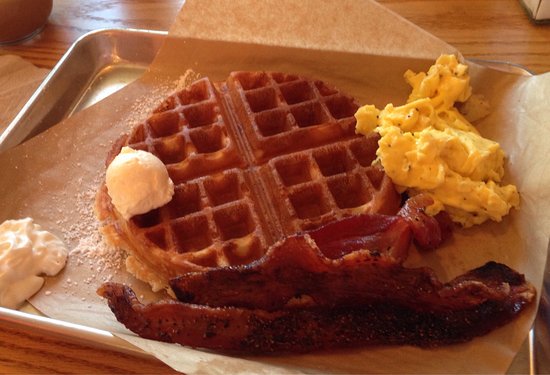
Locate an element on the screen. Image resolution: width=550 pixels, height=375 pixels. sheet is located at coordinates (89, 146).